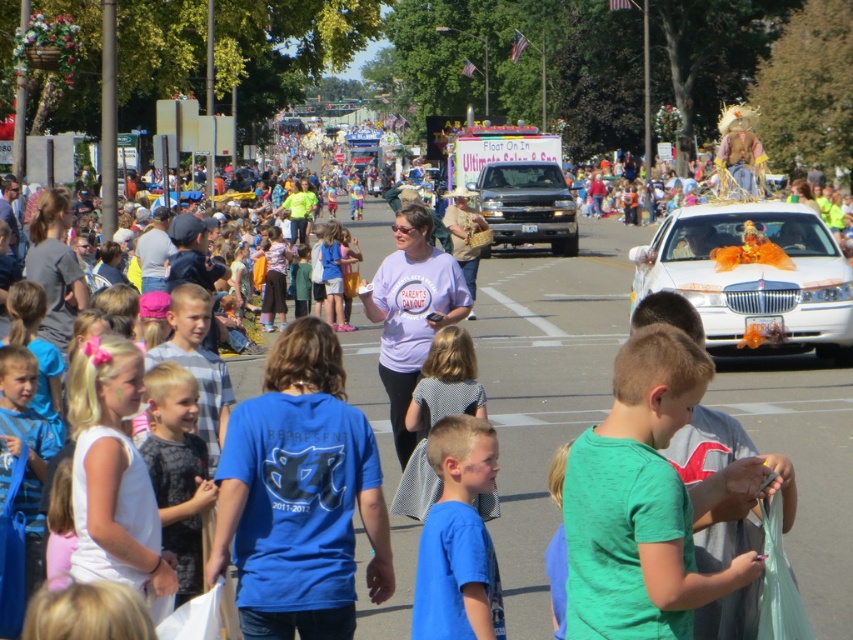
Question: Which point is farther to the camera?

Choices:
 (A) (196, 492)
 (B) (798, 262)
 (C) (473, 582)
 (D) (418, 385)

Answer: (B)

Question: Can you confirm if white glossy sedan at center is positioned below dark gray printed shirt at center?

Choices:
 (A) yes
 (B) no

Answer: (B)

Question: Is blue cotton shirt at center to the right of dark gray printed shirt at center from the viewer's perspective?

Choices:
 (A) yes
 (B) no

Answer: (A)

Question: Which object appears farthest from the camera in this image?

Choices:
 (A) dark gray printed shirt at center
 (B) white glossy sedan at center
 (C) blue t-shirt at center
 (D) blue cotton shirt at center

Answer: (B)

Question: Estimate the real-world distances between objects in this image. Which object is closer to the blue cotton shirt at center?

Choices:
 (A) blue t-shirt at center
 (B) white glossy sedan at center
 (C) dark gray printed shirt at center

Answer: (C)

Question: Can you confirm if white glossy sedan at center is bigger than blue t-shirt at center?

Choices:
 (A) no
 (B) yes

Answer: (A)